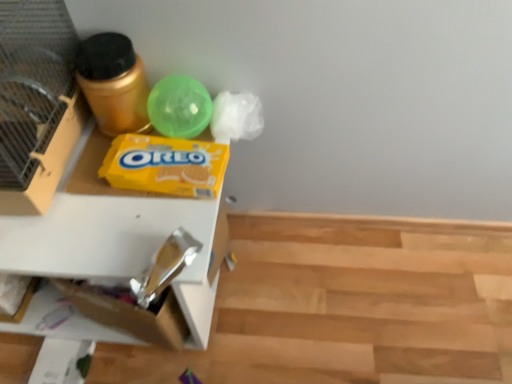
Where is `empty space that is ontop of wooden floor at lower right (from a real-world perspective)`? The width and height of the screenshot is (512, 384). empty space that is ontop of wooden floor at lower right (from a real-world perspective) is located at coordinates (327, 311).